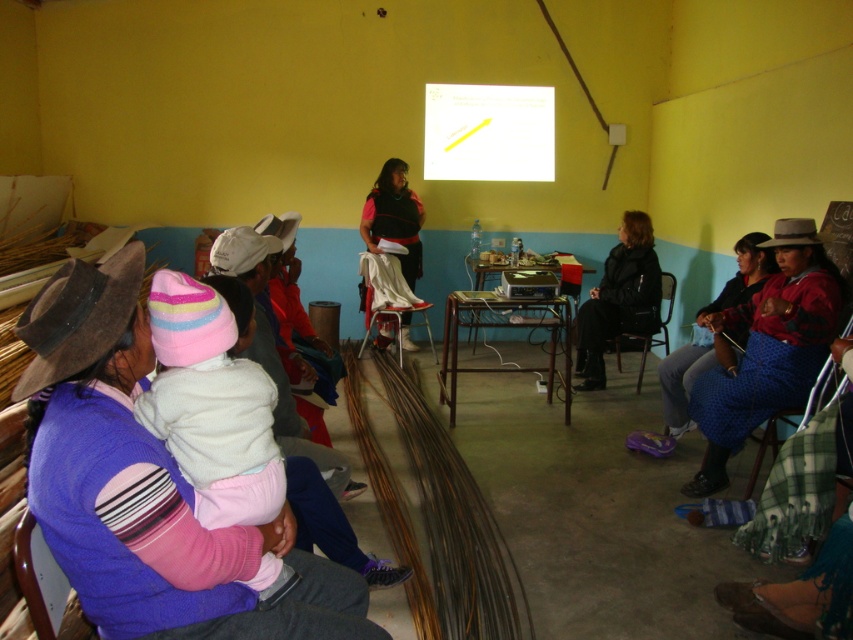
Does pink knitted hat at left appear under matte black vest at center?

Yes, pink knitted hat at left is below matte black vest at center.

The image size is (853, 640). What do you see at coordinates (296, 413) in the screenshot?
I see `pink knitted hat at left` at bounding box center [296, 413].

In order to click on pink knitted hat at left in this screenshot , I will do `click(296, 413)`.

Is blue woven skirt at lower right closer to the viewer compared to polka dot fabric at lower right?

Yes, it is in front of polka dot fabric at lower right.

Can you confirm if blue woven skirt at lower right is bigger than polka dot fabric at lower right?

No, blue woven skirt at lower right is not bigger than polka dot fabric at lower right.

Is point (809, 380) positioned before point (662, 360)?

Yes.

Locate an element on the screen. This screenshot has width=853, height=640. blue woven skirt at lower right is located at coordinates (769, 348).

Image resolution: width=853 pixels, height=640 pixels. What do you see at coordinates (711, 333) in the screenshot? I see `polka dot fabric at lower right` at bounding box center [711, 333].

Between point (740, 243) and point (396, 216), which one is positioned in front?

Point (740, 243) is in front.

Is point (763, 232) positioned before point (409, 342)?

Yes, it is.

This screenshot has height=640, width=853. I want to click on polka dot fabric at lower right, so click(x=711, y=333).